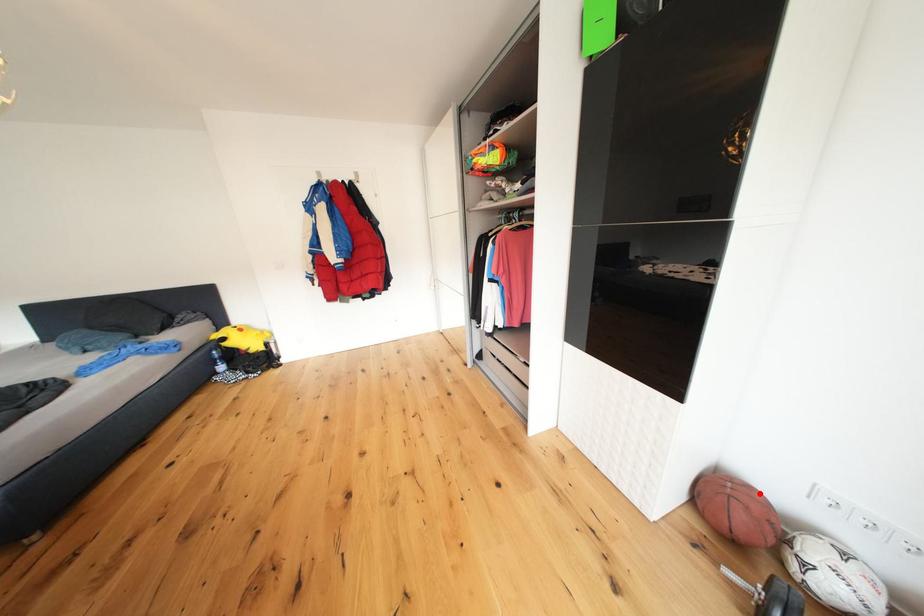
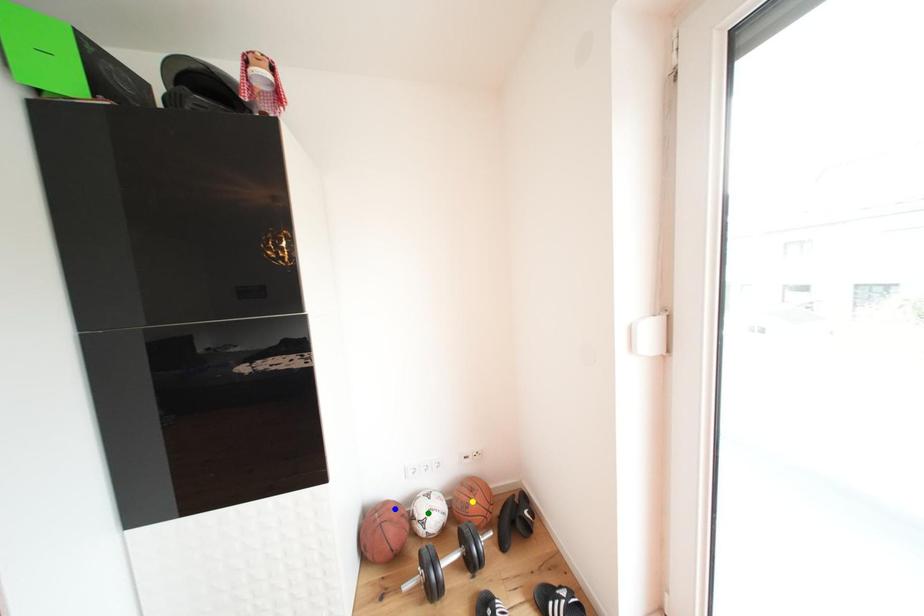
Question: I am providing you with two images of the same scene from different viewpoints. A red point is marked on the first image. You are given multiple points on the second image. Which spot in image 2 lines up with the point in image 1?

Choices:
 (A) green point
 (B) blue point
 (C) yellow point

Answer: (B)